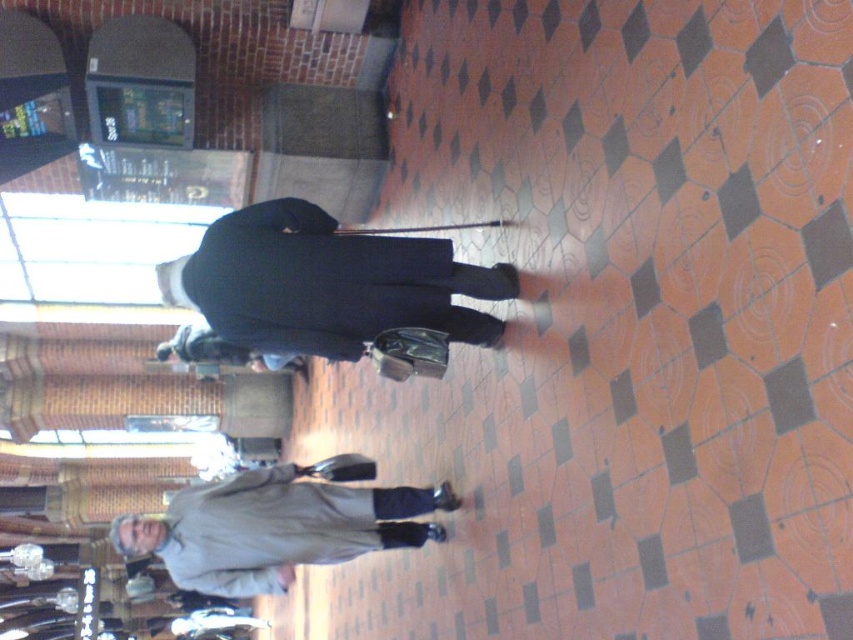
Can you confirm if dark wool coat at center is positioned below light gray fabric coat at lower center?

No, dark wool coat at center is not below light gray fabric coat at lower center.

Find the location of a particular element. This screenshot has width=853, height=640. dark wool coat at center is located at coordinates (325, 284).

Where is `dark wool coat at center`? The width and height of the screenshot is (853, 640). dark wool coat at center is located at coordinates (325, 284).